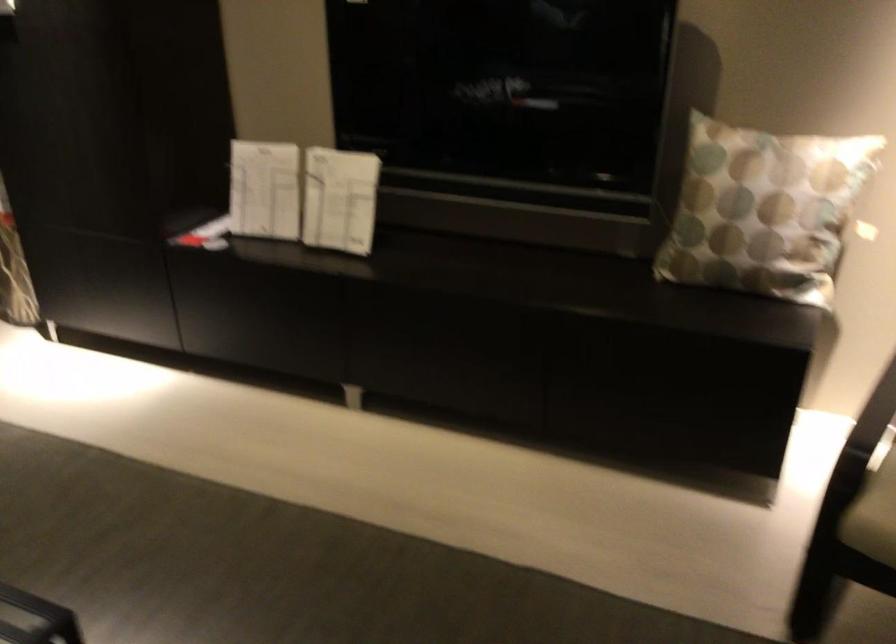
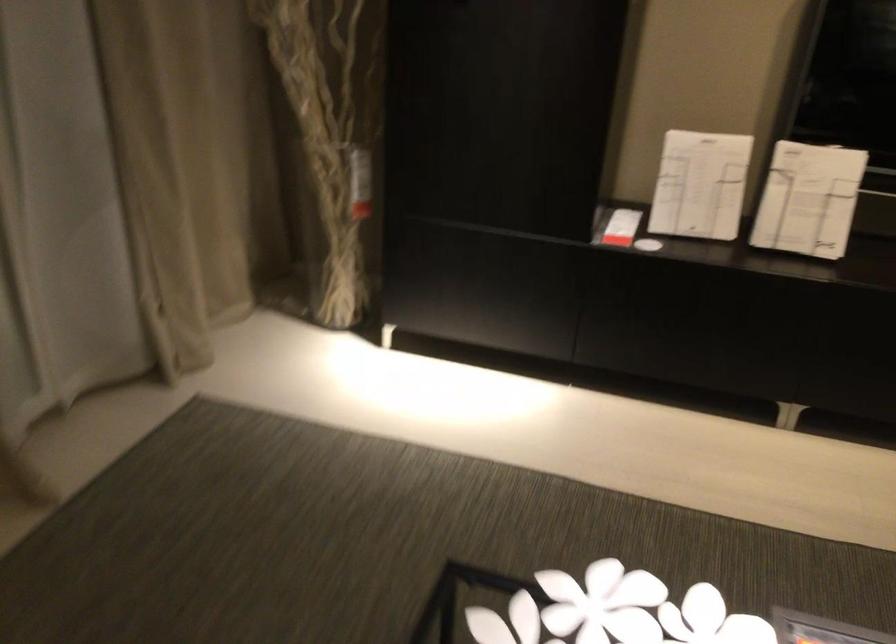
Locate, in the second image, the point that corresponds to point (263, 191) in the first image.

(700, 185)